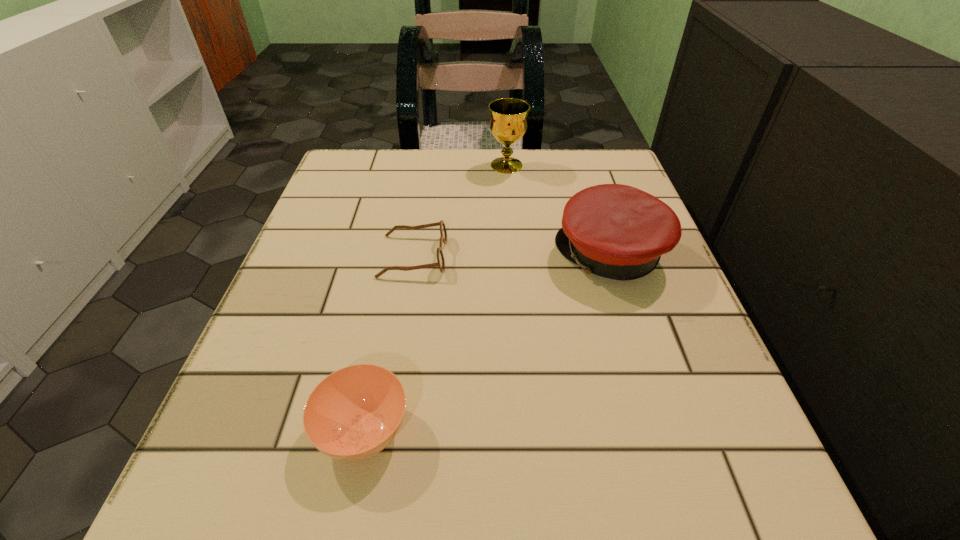
The height and width of the screenshot is (540, 960). I want to click on vacant region between the shortest object and the third tallest object, so click(x=389, y=343).

At what (x,y) coordinates should I click in order to perform the action: click on vacant area that lies between the cap and the shortest object. Please return your answer as a coordinate pair (x, y). This screenshot has height=540, width=960. Looking at the image, I should click on (512, 255).

Where is `free space between the rightmost object and the spectacles`? The height and width of the screenshot is (540, 960). free space between the rightmost object and the spectacles is located at coordinates point(512,255).

Identify the location of vacant space that's between the spectacles and the farthest object. (460, 211).

I want to click on vacant space in between the farthest object and the third tallest object, so click(x=435, y=298).

The width and height of the screenshot is (960, 540). I want to click on object that can be found as the closest to the spectacles, so click(616, 231).

Identify which object is located as the third nearest to the soup bowl. Please provide its 2D coordinates. Your answer should be formatted as a tuple, i.e. [(x, y)], where the tuple contains the x and y coordinates of a point satisfying the conditions above.

[(508, 124)]

Identify the location of vacant space that satisfies the following two spatial constraints: 1. at the front of the second tallest object where the visor is located; 2. on the front side of the nearest object. This screenshot has width=960, height=540. (667, 430).

The height and width of the screenshot is (540, 960). In order to click on free point that satisfies the following two spatial constraints: 1. at the front of the cap where the visor is located; 2. on the front side of the third tallest object in this screenshot , I will do `click(667, 430)`.